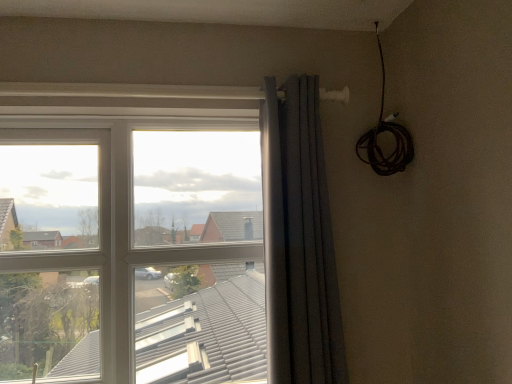
Question: Is dark gray textured curtain at center turned away from transparent glass window at center?

Choices:
 (A) yes
 (B) no

Answer: (A)

Question: Is dark gray textured curtain at center smaller than transparent glass window at center?

Choices:
 (A) no
 (B) yes

Answer: (B)

Question: Is dark gray textured curtain at center bigger than transparent glass window at center?

Choices:
 (A) yes
 (B) no

Answer: (B)

Question: Is dark gray textured curtain at center facing towards transparent glass window at center?

Choices:
 (A) no
 (B) yes

Answer: (A)

Question: Would you say dark gray textured curtain at center is outside transparent glass window at center?

Choices:
 (A) no
 (B) yes

Answer: (B)

Question: Is dark gray textured curtain at center next to transparent glass window at center?

Choices:
 (A) yes
 (B) no

Answer: (B)

Question: Can you confirm if transparent glass window at center is bigger than dark gray textured curtain at center?

Choices:
 (A) no
 (B) yes

Answer: (B)

Question: From the image's perspective, would you say transparent glass window at center is positioned over dark gray textured curtain at center?

Choices:
 (A) yes
 (B) no

Answer: (B)

Question: From a real-world perspective, is transparent glass window at center located beneath dark gray textured curtain at center?

Choices:
 (A) no
 (B) yes

Answer: (B)

Question: Does transparent glass window at center lie behind dark gray textured curtain at center?

Choices:
 (A) yes
 (B) no

Answer: (A)

Question: Is transparent glass window at center turned away from dark gray textured curtain at center?

Choices:
 (A) yes
 (B) no

Answer: (B)

Question: Would you say transparent glass window at center is outside dark gray textured curtain at center?

Choices:
 (A) yes
 (B) no

Answer: (A)

Question: From the image's perspective, relative to dark gray textured curtain at center, is transparent glass window at center above or below?

Choices:
 (A) below
 (B) above

Answer: (A)